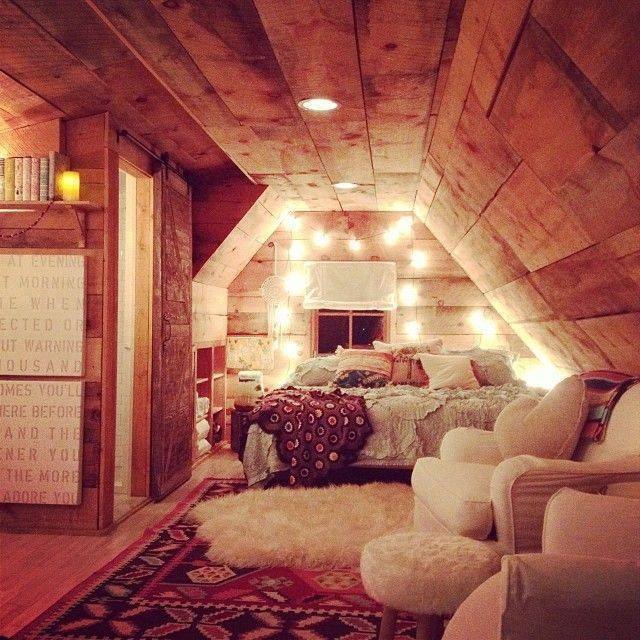
Locate an element on the screen. folded blankets is located at coordinates (201, 445), (198, 434), (198, 411), (214, 428).